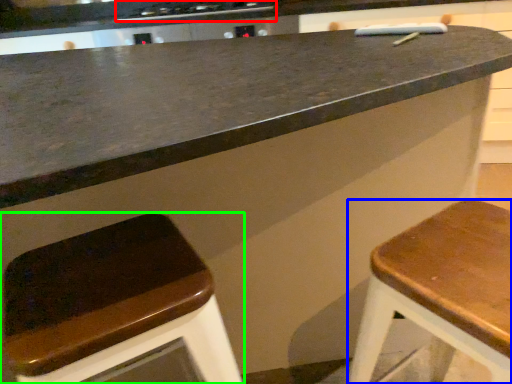
Question: Based on their relative distances, which object is nearer to stove (highlighted by a red box)? Choose from stool (highlighted by a blue box) and stool (highlighted by a green box).

Choices:
 (A) stool
 (B) stool

Answer: (B)